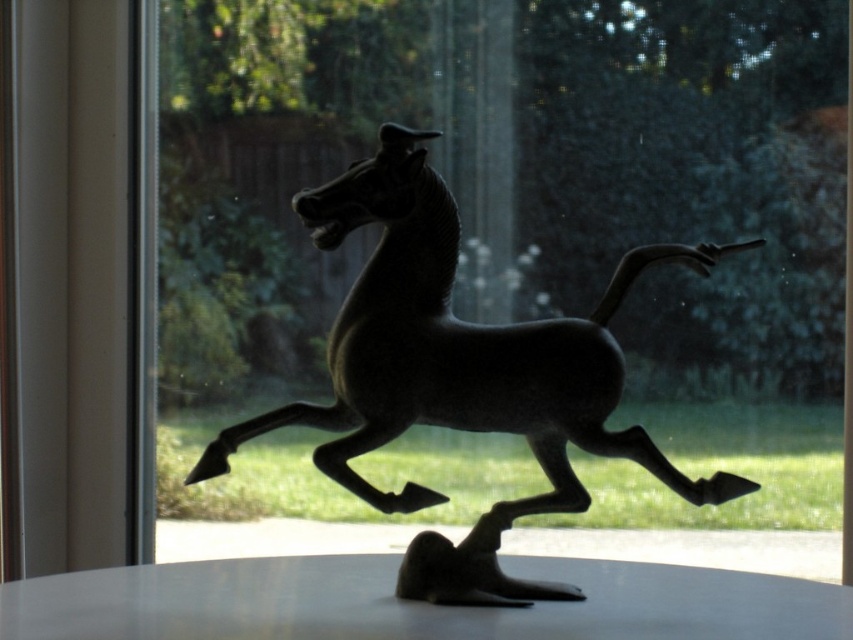
Does shiny bronze horse at center appear on the right side of white glossy table at center?

Correct, you'll find shiny bronze horse at center to the right of white glossy table at center.

Is point (393, 330) positioned behind point (714, 593)?

No, (393, 330) is closer to viewer.

The image size is (853, 640). I want to click on shiny bronze horse at center, so click(459, 349).

This screenshot has height=640, width=853. I want to click on shiny bronze horse at center, so click(x=459, y=349).